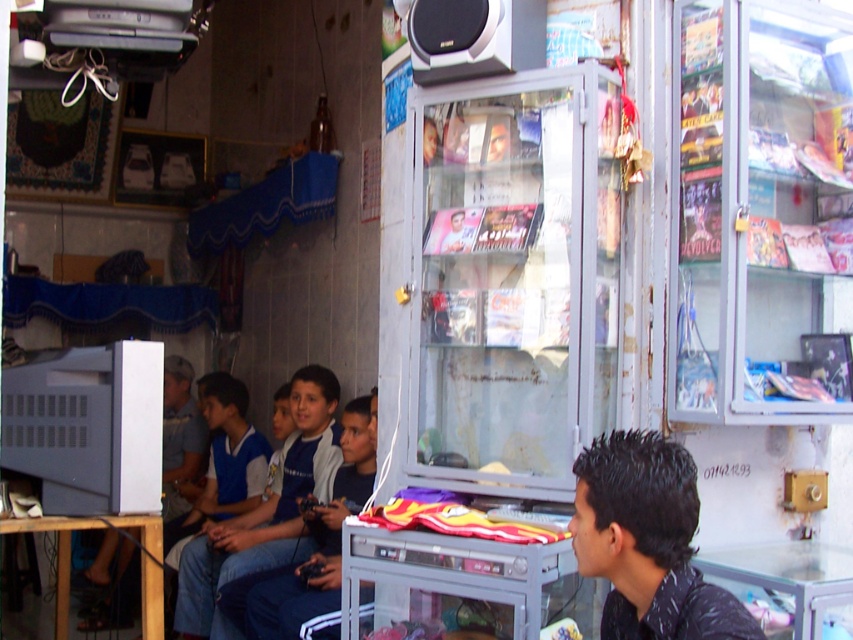
Between dark blue jeans at center and matte black speaker at upper center, which one is positioned lower?

dark blue jeans at center

Is point (321, 592) behind point (473, 68)?

Yes, point (321, 592) is behind point (473, 68).

Who is more forward, (347, 417) or (540, 36)?

Positioned in front is point (540, 36).

The image size is (853, 640). Find the location of `dark blue jeans at center`. dark blue jeans at center is located at coordinates (318, 545).

What do you see at coordinates (647, 541) in the screenshot? This screenshot has height=640, width=853. I see `black matte hair at center` at bounding box center [647, 541].

Is point (680, 538) in front of point (212, 625)?

Yes, it is in front of point (212, 625).

Find the location of `black matte hair at center`. black matte hair at center is located at coordinates (647, 541).

Is black matte hair at center below dark blue jeans at center?

Actually, black matte hair at center is above dark blue jeans at center.

Does black matte hair at center have a lesser width compared to dark blue jeans at center?

Indeed, black matte hair at center has a lesser width compared to dark blue jeans at center.

Where is `black matte hair at center`? black matte hair at center is located at coordinates (647, 541).